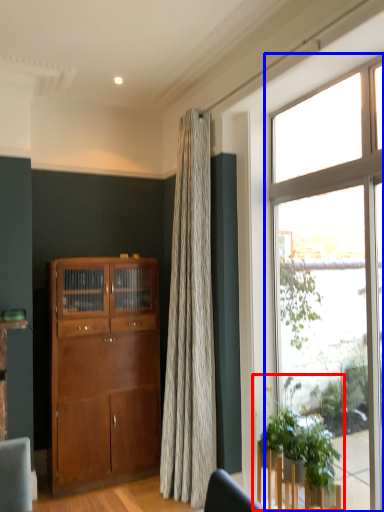
Question: Among these objects, which one is farthest to the camera, houseplant (highlighted by a red box) or window (highlighted by a blue box)?

Choices:
 (A) houseplant
 (B) window

Answer: (B)